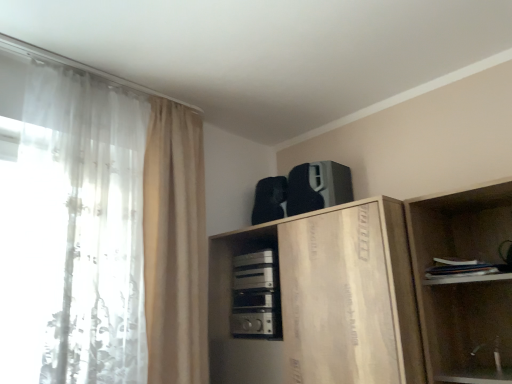
This screenshot has height=384, width=512. What do you see at coordinates (324, 300) in the screenshot?
I see `wooden cabinet at upper center` at bounding box center [324, 300].

Image resolution: width=512 pixels, height=384 pixels. Describe the element at coordinates (318, 187) in the screenshot. I see `black matte speaker at upper center, marked as the second appliance in a bottom-to-top arrangement` at that location.

You are a GUI agent. You are given a task and a screenshot of the screen. Output one action in this format:
    pyautogui.click(x=<x>, y=<y>)
    Task: Click on the beige fabric curtain at left, which ranks as the second curtain in left-to-right order
    This screenshot has height=384, width=512.
    Given the screenshot: What is the action you would take?
    pyautogui.click(x=175, y=245)

The height and width of the screenshot is (384, 512). Describe the element at coordinates (175, 245) in the screenshot. I see `beige fabric curtain at left, which ranks as the second curtain in left-to-right order` at that location.

Locate an element on the screen. The image size is (512, 384). white paper book at right is located at coordinates (462, 268).

Where is `wooden cabinet at upper center`? wooden cabinet at upper center is located at coordinates coord(324,300).

Considering the sizes of objects wooden cabinet at upper center and satin silver appliance at center, positioned as the 1th appliance in bottom-to-top order, in the image provided, who is bigger, wooden cabinet at upper center or satin silver appliance at center, positioned as the 1th appliance in bottom-to-top order,?

Bigger between the two is wooden cabinet at upper center.

From a real-world perspective, between wooden cabinet at upper center and satin silver appliance at center, positioned as the 1th appliance in bottom-to-top order, who is vertically lower?

wooden cabinet at upper center is physically lower.

Is satin silver appliance at center, the 2th appliance from the top, a part of wooden cabinet at upper center?

Yes, wooden cabinet at upper center is surrounding satin silver appliance at center, the 2th appliance from the top.

Which object is positioned more to the right, wooden cabinet at upper center or satin silver appliance at center, the 2th appliance from the top?

wooden cabinet at upper center.

Is black matte speaker at upper center, positioned as the first appliance in top-to-bottom order, inside beige fabric curtain at left, which ranks as the second curtain in left-to-right order?

No, black matte speaker at upper center, positioned as the first appliance in top-to-bottom order, is not inside beige fabric curtain at left, which ranks as the second curtain in left-to-right order.

Which is in front, beige fabric curtain at left, which ranks as the second curtain in left-to-right order, or black matte speaker at upper center, positioned as the first appliance in top-to-bottom order?

beige fabric curtain at left, which ranks as the second curtain in left-to-right order, is in front.

Based on their sizes in the image, would you say beige fabric curtain at left, which ranks as the second curtain in left-to-right order, is bigger or smaller than black matte speaker at upper center, marked as the second appliance in a bottom-to-top arrangement?

Considering their sizes, beige fabric curtain at left, which ranks as the second curtain in left-to-right order, takes up more space than black matte speaker at upper center, marked as the second appliance in a bottom-to-top arrangement.

Is point (148, 320) positioned before point (350, 187)?

Yes.

Can you tell me how much satin silver appliance at center, the 2th appliance from the top, and beige fabric curtain at left, which ranks as the second curtain in left-to-right order, differ in facing direction?

They differ by 87.5 degrees in their facing directions.

Is satin silver appliance at center, positioned as the 1th appliance in bottom-to-top order, outside of beige fabric curtain at left, which ranks as the second curtain in left-to-right order?

Yes, satin silver appliance at center, positioned as the 1th appliance in bottom-to-top order, is located beyond the bounds of beige fabric curtain at left, which ranks as the second curtain in left-to-right order.

Is satin silver appliance at center, positioned as the 1th appliance in bottom-to-top order, touching beige fabric curtain at left, which ranks as the second curtain in left-to-right order?

No, satin silver appliance at center, positioned as the 1th appliance in bottom-to-top order, is not in contact with beige fabric curtain at left, which ranks as the second curtain in left-to-right order.

From their relative heights in the image, would you say beige fabric curtain at left, which is counted as the 1th curtain, starting from the right, is taller or shorter than wooden cabinet at upper center?

Clearly, beige fabric curtain at left, which is counted as the 1th curtain, starting from the right, is taller compared to wooden cabinet at upper center.

From the image's perspective, is beige fabric curtain at left, which ranks as the second curtain in left-to-right order, located above or below wooden cabinet at upper center?

beige fabric curtain at left, which ranks as the second curtain in left-to-right order, is situated higher than wooden cabinet at upper center in the image.

Is beige fabric curtain at left, which ranks as the second curtain in left-to-right order, in front of wooden cabinet at upper center?

No, beige fabric curtain at left, which ranks as the second curtain in left-to-right order, is behind wooden cabinet at upper center.

From the picture: How far apart are beige fabric curtain at left, which is counted as the 1th curtain, starting from the right, and wooden cabinet at upper center?

They are 18.44 inches apart.

Is point (315, 163) closer or farther from the camera than point (156, 284)?

Point (315, 163) is farther from the camera than point (156, 284).

From the picture: Between black matte speaker at upper center, marked as the second appliance in a bottom-to-top arrangement, and beige fabric curtain at left, which is counted as the 1th curtain, starting from the right, which one has smaller width?

With smaller width is beige fabric curtain at left, which is counted as the 1th curtain, starting from the right.

Looking at this image, from the image's perspective, is black matte speaker at upper center, marked as the second appliance in a bottom-to-top arrangement, beneath beige fabric curtain at left, which ranks as the second curtain in left-to-right order?

No, from the image's perspective, black matte speaker at upper center, marked as the second appliance in a bottom-to-top arrangement, is not below beige fabric curtain at left, which ranks as the second curtain in left-to-right order.

Starting from the beige fabric curtain at left, which is counted as the 1th curtain, starting from the right, which appliance is the 2nd one to the right? Please provide its 2D coordinates.

[(318, 187)]

Considering the positions of objects beige fabric curtain at left, which ranks as the second curtain in left-to-right order, and white sheer curtain at left, which appears as the first curtain when viewed from the left, in the image provided, who is more to the right, beige fabric curtain at left, which ranks as the second curtain in left-to-right order, or white sheer curtain at left, which appears as the first curtain when viewed from the left,?

beige fabric curtain at left, which ranks as the second curtain in left-to-right order, is more to the right.

Is beige fabric curtain at left, which is counted as the 1th curtain, starting from the right, spatially inside white sheer curtain at left, acting as the second curtain starting from the right, or outside of it?

beige fabric curtain at left, which is counted as the 1th curtain, starting from the right, exists outside the volume of white sheer curtain at left, acting as the second curtain starting from the right.

Could you tell me if beige fabric curtain at left, which ranks as the second curtain in left-to-right order, is turned towards white sheer curtain at left, acting as the second curtain starting from the right?

No, beige fabric curtain at left, which ranks as the second curtain in left-to-right order, is not turned towards white sheer curtain at left, acting as the second curtain starting from the right.

From the image's perspective, is wooden cabinet at upper center above or below black matte speaker at upper center, marked as the second appliance in a bottom-to-top arrangement?

Clearly, from the image's perspective, wooden cabinet at upper center is below black matte speaker at upper center, marked as the second appliance in a bottom-to-top arrangement.

Is point (392, 310) positioned before point (342, 178)?

Yes, it is in front of point (342, 178).

Considering the relative positions of wooden cabinet at upper center and black matte speaker at upper center, positioned as the first appliance in top-to-bottom order, in the image provided, is wooden cabinet at upper center to the left of black matte speaker at upper center, positioned as the first appliance in top-to-bottom order, from the viewer's perspective?

Correct, you'll find wooden cabinet at upper center to the left of black matte speaker at upper center, positioned as the first appliance in top-to-bottom order.

Would you say wooden cabinet at upper center is a long distance from black matte speaker at upper center, marked as the second appliance in a bottom-to-top arrangement?

That's not correct — wooden cabinet at upper center is a little close to black matte speaker at upper center, marked as the second appliance in a bottom-to-top arrangement.

You are a GUI agent. You are given a task and a screenshot of the screen. Output one action in this format:
    pyautogui.click(x=<x>, y=<y>)
    Task: Click on the appliance that is the 1st object above the wooden cabinet at upper center (from a real-world perspective)
    This screenshot has width=512, height=384.
    Given the screenshot: What is the action you would take?
    pyautogui.click(x=256, y=296)

You are a GUI agent. You are given a task and a screenshot of the screen. Output one action in this format:
    pyautogui.click(x=<x>, y=<y>)
    Task: Click on the 2nd curtain below the black matte speaker at upper center, positioned as the first appliance in top-to-bottom order (from a real-world perspective)
    
    Given the screenshot: What is the action you would take?
    pyautogui.click(x=175, y=245)

Looking at the image, which one is located further to white sheer curtain at left, which appears as the first curtain when viewed from the left, satin silver appliance at center, positioned as the 1th appliance in bottom-to-top order, or beige fabric curtain at left, which ranks as the second curtain in left-to-right order?

satin silver appliance at center, positioned as the 1th appliance in bottom-to-top order, is positioned further to the anchor white sheer curtain at left, which appears as the first curtain when viewed from the left.

Looking at the image, which one is located closer to satin silver appliance at center, the 2th appliance from the top, white paper book at right or wooden cabinet at upper center?

wooden cabinet at upper center lies closer to satin silver appliance at center, the 2th appliance from the top, than the other object.

When comparing their distances from satin silver appliance at center, the 2th appliance from the top, does black matte speaker at upper center, positioned as the first appliance in top-to-bottom order, or white paper book at right seem closer?

Based on the image, black matte speaker at upper center, positioned as the first appliance in top-to-bottom order, appears to be nearer to satin silver appliance at center, the 2th appliance from the top.

Estimate the real-world distances between objects in this image. Which object is closer to beige fabric curtain at left, which ranks as the second curtain in left-to-right order, white sheer curtain at left, which appears as the first curtain when viewed from the left, or black matte speaker at upper center, positioned as the first appliance in top-to-bottom order?

white sheer curtain at left, which appears as the first curtain when viewed from the left, lies closer to beige fabric curtain at left, which ranks as the second curtain in left-to-right order, than the other object.

From the image, which object appears to be nearer to white sheer curtain at left, which appears as the first curtain when viewed from the left, white paper book at right or black matte speaker at upper center, marked as the second appliance in a bottom-to-top arrangement?

black matte speaker at upper center, marked as the second appliance in a bottom-to-top arrangement, is positioned closer to the anchor white sheer curtain at left, which appears as the first curtain when viewed from the left.

Considering their positions, is black matte speaker at upper center, marked as the second appliance in a bottom-to-top arrangement, positioned further to white sheer curtain at left, which appears as the first curtain when viewed from the left, than satin silver appliance at center, positioned as the 1th appliance in bottom-to-top order?

black matte speaker at upper center, marked as the second appliance in a bottom-to-top arrangement, lies further to white sheer curtain at left, which appears as the first curtain when viewed from the left, than the other object.

Looking at the image, which one is located further to beige fabric curtain at left, which ranks as the second curtain in left-to-right order, satin silver appliance at center, positioned as the 1th appliance in bottom-to-top order, or white paper book at right?

The object further to beige fabric curtain at left, which ranks as the second curtain in left-to-right order, is white paper book at right.

Which object lies nearer to the anchor point beige fabric curtain at left, which is counted as the 1th curtain, starting from the right, satin silver appliance at center, positioned as the 1th appliance in bottom-to-top order, or black matte speaker at upper center, positioned as the first appliance in top-to-bottom order?

Among the two, satin silver appliance at center, positioned as the 1th appliance in bottom-to-top order, is located nearer to beige fabric curtain at left, which is counted as the 1th curtain, starting from the right.

Where is `appliance located between white sheer curtain at left, which appears as the first curtain when viewed from the left, and wooden cabinet at upper center in the left-right direction`? This screenshot has width=512, height=384. appliance located between white sheer curtain at left, which appears as the first curtain when viewed from the left, and wooden cabinet at upper center in the left-right direction is located at coordinates (256, 296).

Locate an element on the screen. cabinetry located between white sheer curtain at left, which appears as the first curtain when viewed from the left, and black matte speaker at upper center, marked as the second appliance in a bottom-to-top arrangement, in the left-right direction is located at coordinates (324, 300).

Locate an element on the screen. This screenshot has width=512, height=384. cabinetry between satin silver appliance at center, positioned as the 1th appliance in bottom-to-top order, and white paper book at right is located at coordinates (324, 300).

At what (x,y) coordinates should I click in order to perform the action: click on curtain located between wooden cabinet at upper center and satin silver appliance at center, positioned as the 1th appliance in bottom-to-top order, in the depth direction. Please return your answer as a coordinate pair (x, y). Looking at the image, I should click on (175, 245).